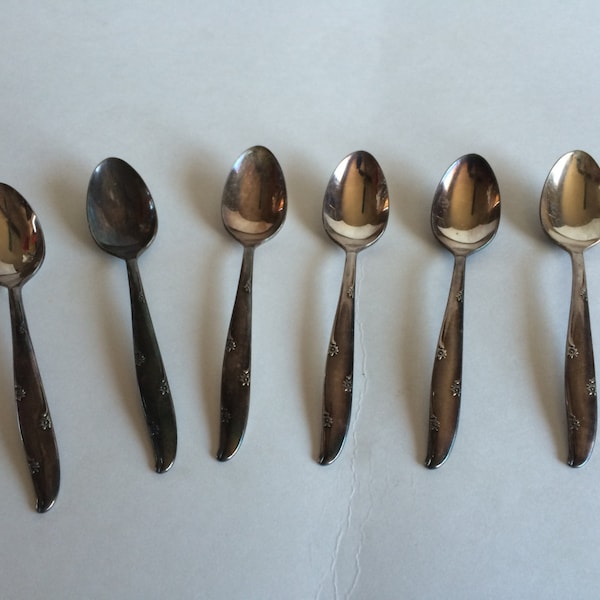
The height and width of the screenshot is (600, 600). Identify the location of spoons. click(22, 247), click(112, 222), click(248, 202), click(350, 210), click(464, 218), click(581, 213).